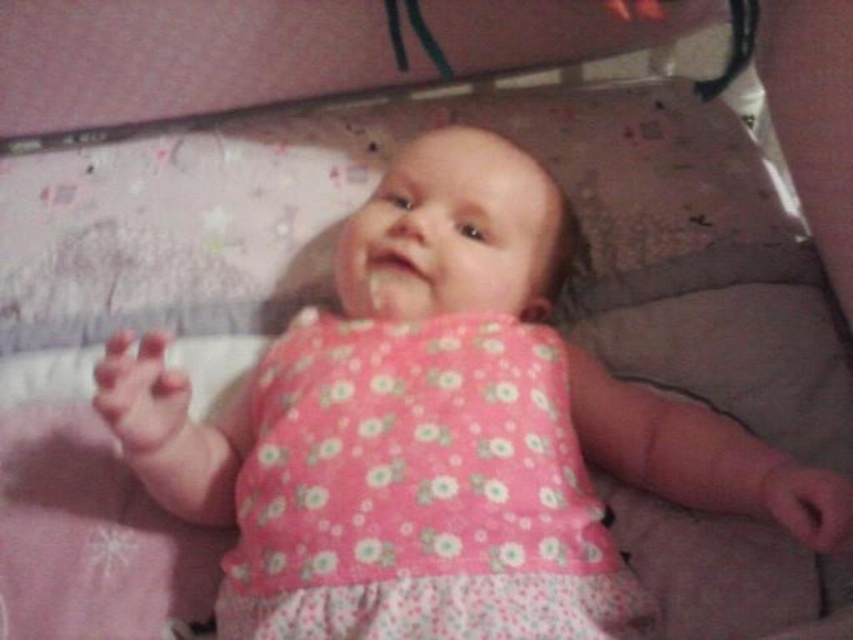
Between pink floral dress at center and pink floral fabric dress at center, which one is positioned higher?

pink floral dress at center is above.

Who is positioned more to the right, pink floral dress at center or pink floral fabric dress at center?

From the viewer's perspective, pink floral fabric dress at center appears more on the right side.

Between point (440, 454) and point (332, 636), which one is positioned behind?

The point (440, 454) is behind.

You are a GUI agent. You are given a task and a screenshot of the screen. Output one action in this format:
    pyautogui.click(x=<x>, y=<y>)
    Task: Click on the pink floral dress at center
    This screenshot has width=853, height=640.
    Given the screenshot: What is the action you would take?
    [x=550, y=330]